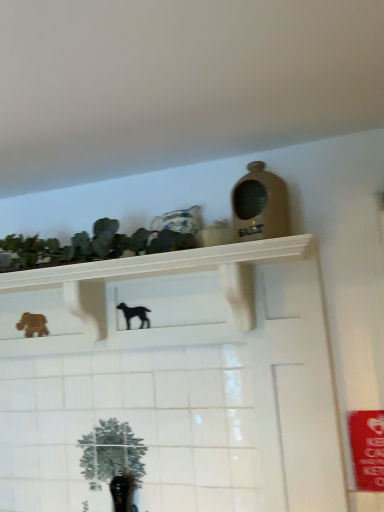
Question: Which direction should I rotate to look at black matte dog at center, the 2th animal positioned from the left, — up or down?

Choices:
 (A) up
 (B) down

Answer: (B)

Question: Does white glossy shelf at upper center have a smaller size compared to green matte cactus at upper left?

Choices:
 (A) yes
 (B) no

Answer: (B)

Question: Is the surface of white glossy shelf at upper center in direct contact with green matte cactus at upper left?

Choices:
 (A) yes
 (B) no

Answer: (B)

Question: Does white glossy shelf at upper center have a greater height compared to green matte cactus at upper left?

Choices:
 (A) no
 (B) yes

Answer: (B)

Question: Is white glossy shelf at upper center bigger than green matte cactus at upper left?

Choices:
 (A) yes
 (B) no

Answer: (A)

Question: Does white glossy shelf at upper center have a lesser width compared to green matte cactus at upper left?

Choices:
 (A) no
 (B) yes

Answer: (A)

Question: Does white glossy shelf at upper center appear on the right side of green matte cactus at upper left?

Choices:
 (A) yes
 (B) no

Answer: (A)

Question: From the image's perspective, is wooden horse at left, the second animal in the front-to-back sequence, on white glossy shelf at upper center?

Choices:
 (A) no
 (B) yes

Answer: (A)

Question: Can you confirm if wooden horse at left, which ranks as the 1th animal in left-to-right order, is smaller than white glossy shelf at upper center?

Choices:
 (A) no
 (B) yes

Answer: (B)

Question: Are wooden horse at left, which ranks as the 1th animal in left-to-right order, and white glossy shelf at upper center located far from each other?

Choices:
 (A) yes
 (B) no

Answer: (B)

Question: Considering the relative sizes of wooden horse at left, the second animal in the front-to-back sequence, and white glossy shelf at upper center in the image provided, is wooden horse at left, the second animal in the front-to-back sequence, bigger than white glossy shelf at upper center?

Choices:
 (A) yes
 (B) no

Answer: (B)

Question: Considering the relative sizes of wooden horse at left, the 2th animal viewed from the right, and white glossy shelf at upper center in the image provided, is wooden horse at left, the 2th animal viewed from the right, taller than white glossy shelf at upper center?

Choices:
 (A) no
 (B) yes

Answer: (A)

Question: Is wooden horse at left, which ranks as the 1th animal in left-to-right order, touching white glossy shelf at upper center?

Choices:
 (A) no
 (B) yes

Answer: (A)

Question: Can you confirm if black matte dog at center, which is counted as the first animal, starting from the front, is bigger than green matte cactus at upper left?

Choices:
 (A) yes
 (B) no

Answer: (B)